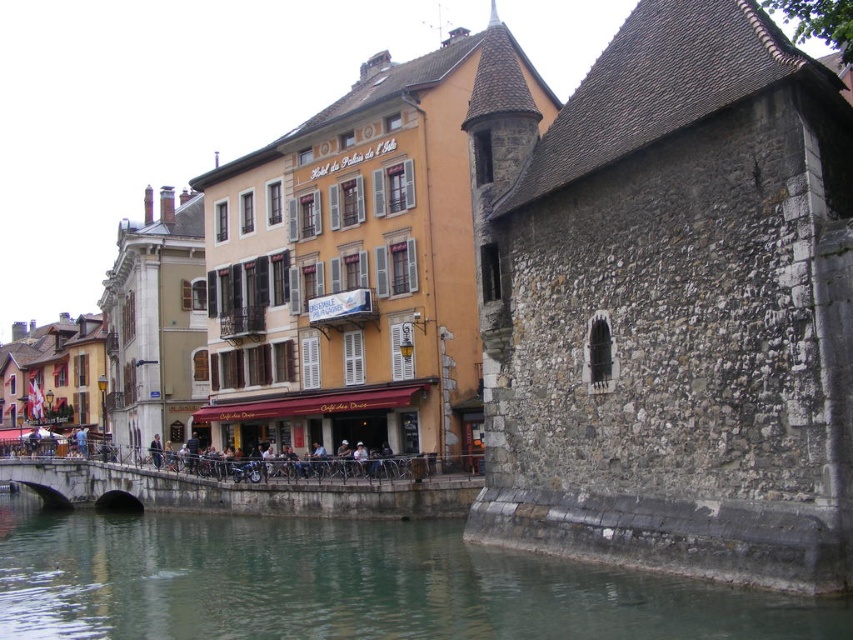
Which is more to the left, greenish stone water at lower left or concrete stone bridge at lower center?

greenish stone water at lower left

Can you confirm if greenish stone water at lower left is positioned above concrete stone bridge at lower center?

No.

Where is `greenish stone water at lower left`? The height and width of the screenshot is (640, 853). greenish stone water at lower left is located at coordinates (347, 584).

I want to click on greenish stone water at lower left, so click(347, 584).